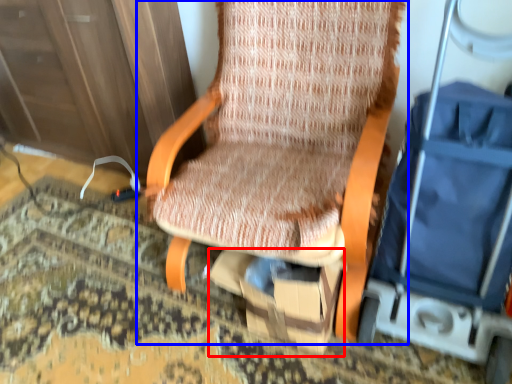
Question: Which object appears closest to the camera in this image, cardboard box (highlighted by a red box) or chair (highlighted by a blue box)?

Choices:
 (A) cardboard box
 (B) chair

Answer: (B)